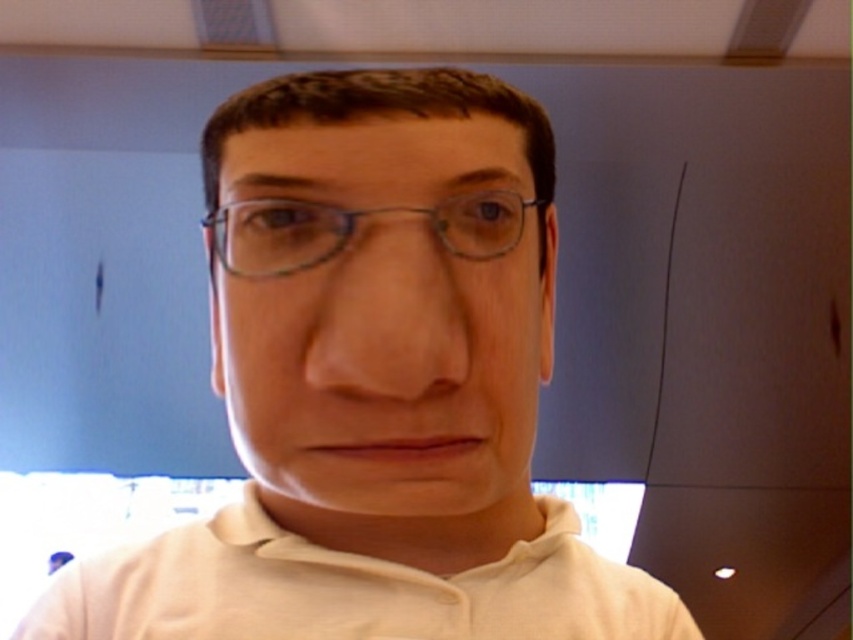
Question: Is matte plastic face at center thinner than clear plastic glasses at center?

Choices:
 (A) no
 (B) yes

Answer: (A)

Question: Among these objects, which one is farthest from the camera?

Choices:
 (A) clear plastic glasses at center
 (B) matte plastic face at center

Answer: (A)

Question: From the image, what is the correct spatial relationship of matte plastic face at center in relation to clear plastic glasses at center?

Choices:
 (A) above
 (B) below

Answer: (B)

Question: Can you confirm if matte plastic face at center is thinner than clear plastic glasses at center?

Choices:
 (A) yes
 (B) no

Answer: (B)

Question: Among these objects, which one is farthest from the camera?

Choices:
 (A) clear plastic glasses at center
 (B) matte plastic face at center

Answer: (A)